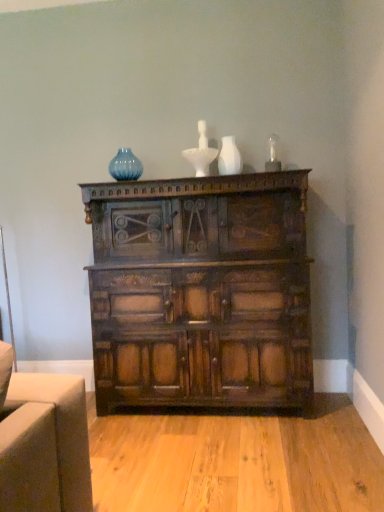
Where is `blank space situated above blue glass vase at upper center (from a real-world perspective)`? The height and width of the screenshot is (512, 384). blank space situated above blue glass vase at upper center (from a real-world perspective) is located at coordinates (118, 148).